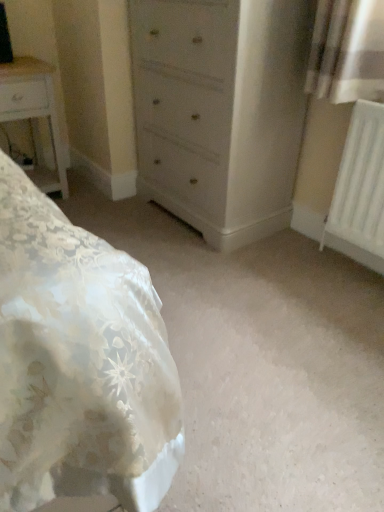
Where is `white glossy nightstand at left`? The height and width of the screenshot is (512, 384). white glossy nightstand at left is located at coordinates (34, 115).

What's the angular difference between light gray wood chest of drawers at center and white glossy nightstand at left's facing directions?

The facing directions of light gray wood chest of drawers at center and white glossy nightstand at left are 90 degrees apart.

Is light gray wood chest of drawers at center facing towards white glossy nightstand at left?

No, light gray wood chest of drawers at center is not oriented towards white glossy nightstand at left.

Which is correct: light gray wood chest of drawers at center is inside white glossy nightstand at left, or outside of it?

light gray wood chest of drawers at center is not enclosed by white glossy nightstand at left.

Which is further, [243,220] or [62,164]?

The point [62,164] is farther from the camera.

Are white plastic radiator at right and light gray wood chest of drawers at center making contact?

There is a gap between white plastic radiator at right and light gray wood chest of drawers at center.

From the image's perspective, which one is positioned higher, white plastic radiator at right or light gray wood chest of drawers at center?

light gray wood chest of drawers at center appears higher in the image.

Looking at this image, does white plastic radiator at right have a greater height compared to light gray wood chest of drawers at center?

In fact, white plastic radiator at right may be shorter than light gray wood chest of drawers at center.

Which object is further away from the camera, white plastic radiator at right or light gray wood chest of drawers at center?

light gray wood chest of drawers at center.

Can you tell me how much white glossy nightstand at left and light gray wood chest of drawers at center differ in facing direction?

The angular difference between white glossy nightstand at left and light gray wood chest of drawers at center is 90 degrees.

In the scene shown: How distant is white glossy nightstand at left from light gray wood chest of drawers at center?

31.91 inches.

Considering the sizes of white glossy nightstand at left and light gray wood chest of drawers at center in the image, is white glossy nightstand at left bigger or smaller than light gray wood chest of drawers at center?

Clearly, white glossy nightstand at left is smaller in size than light gray wood chest of drawers at center.

Which is nearer, (x=23, y=77) or (x=207, y=138)?

The point (x=207, y=138) is more forward.

Which object is further away from the camera taking this photo, white plastic radiator at right or white glossy nightstand at left?

white glossy nightstand at left is further away from the camera.

From a real-world perspective, is white plastic radiator at right physically below white glossy nightstand at left?

No, from a real-world perspective, white plastic radiator at right is not under white glossy nightstand at left.

Is white plastic radiator at right bigger or smaller than white glossy nightstand at left?

Clearly, white plastic radiator at right is smaller in size than white glossy nightstand at left.

Based on the photo, is light gray wood chest of drawers at center wider or thinner than white plastic radiator at right?

light gray wood chest of drawers at center is wider than white plastic radiator at right.

Find the location of a particular element. Image resolution: width=384 pixels, height=512 pixels. radiator in front of the light gray wood chest of drawers at center is located at coordinates (360, 189).

Between light gray wood chest of drawers at center and white plastic radiator at right, which one is positioned in front?

white plastic radiator at right is more forward.

Consider the image. Considering the sizes of light gray wood chest of drawers at center and white plastic radiator at right in the image, is light gray wood chest of drawers at center bigger or smaller than white plastic radiator at right?

light gray wood chest of drawers at center is bigger than white plastic radiator at right.

Is white glossy nightstand at left inside or outside of white plastic radiator at right?

white glossy nightstand at left is not inside white plastic radiator at right, it's outside.

In the scene shown: From the image's perspective, is white glossy nightstand at left above or below white plastic radiator at right?

Clearly, from the image's perspective, white glossy nightstand at left is above white plastic radiator at right.

Could you tell me if white glossy nightstand at left is facing white plastic radiator at right?

No, white glossy nightstand at left is not turned towards white plastic radiator at right.

Are white glossy nightstand at left and white plastic radiator at right far apart?

Indeed, white glossy nightstand at left is not near white plastic radiator at right.

Locate an element on the screen. The height and width of the screenshot is (512, 384). nightstand that is below the light gray wood chest of drawers at center (from the image's perspective) is located at coordinates (34, 115).

This screenshot has width=384, height=512. What are the coordinates of `the chest of drawers behind the white plastic radiator at right` in the screenshot? It's located at (220, 110).

From the image, which object appears to be farther from white glossy nightstand at left, white plastic radiator at right or light gray wood chest of drawers at center?

The object further to white glossy nightstand at left is white plastic radiator at right.

In the scene shown: When comparing their distances from light gray wood chest of drawers at center, does white glossy nightstand at left or white plastic radiator at right seem closer?

white plastic radiator at right.

Based on their spatial positions, is light gray wood chest of drawers at center or white glossy nightstand at left further from white plastic radiator at right?

white glossy nightstand at left is positioned further to the anchor white plastic radiator at right.

Based on their spatial positions, is light gray wood chest of drawers at center or white plastic radiator at right closer to white glossy nightstand at left?

light gray wood chest of drawers at center is closer to white glossy nightstand at left.

Estimate the real-world distances between objects in this image. Which object is closer to white plastic radiator at right, white glossy nightstand at left or light gray wood chest of drawers at center?

light gray wood chest of drawers at center is positioned closer to the anchor white plastic radiator at right.

Based on their spatial positions, is white plastic radiator at right or white glossy nightstand at left closer to light gray wood chest of drawers at center?

white plastic radiator at right is positioned closer to the anchor light gray wood chest of drawers at center.

Where is `the chest of drawers located between white glossy nightstand at left and white plastic radiator at right in the left-right direction`? The height and width of the screenshot is (512, 384). the chest of drawers located between white glossy nightstand at left and white plastic radiator at right in the left-right direction is located at coordinates (220, 110).